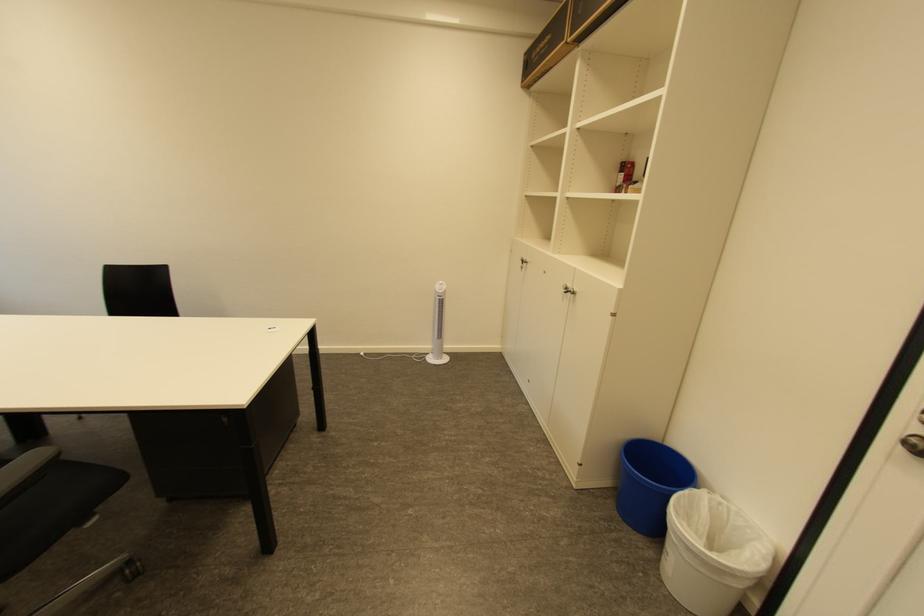
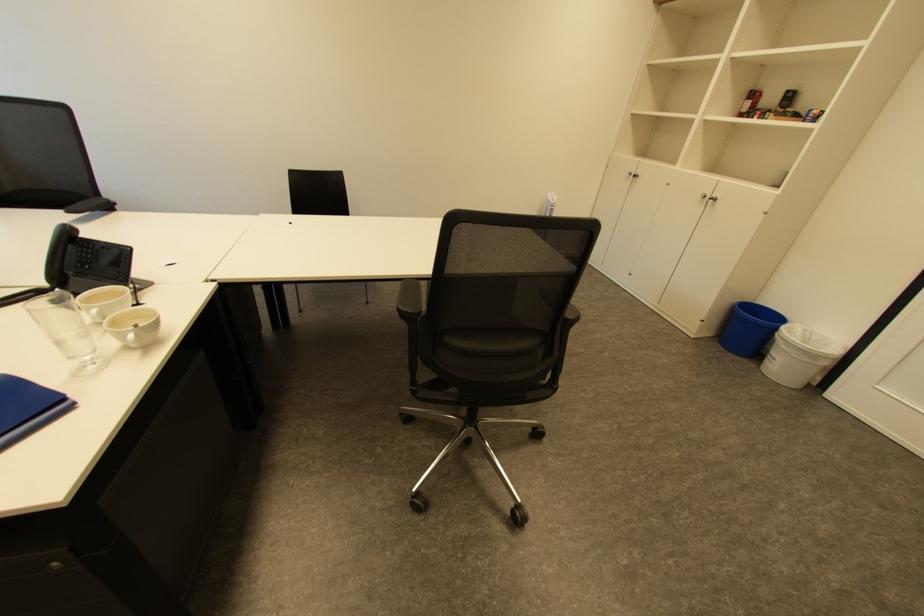
In the second image, find the point that corresponds to pixel 574 288 in the first image.

(711, 196)